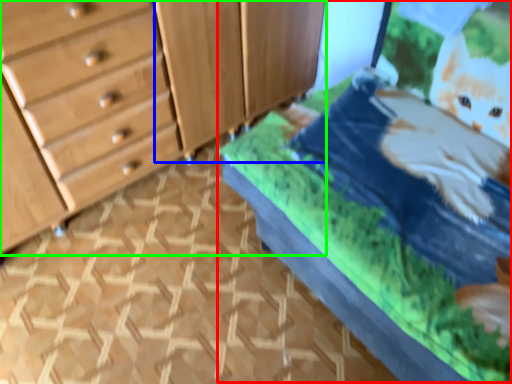
Question: Which is farther away from bed (highlighted by a red box)? cabinetry (highlighted by a blue box) or chest of drawers (highlighted by a green box)?

Choices:
 (A) cabinetry
 (B) chest of drawers

Answer: (B)